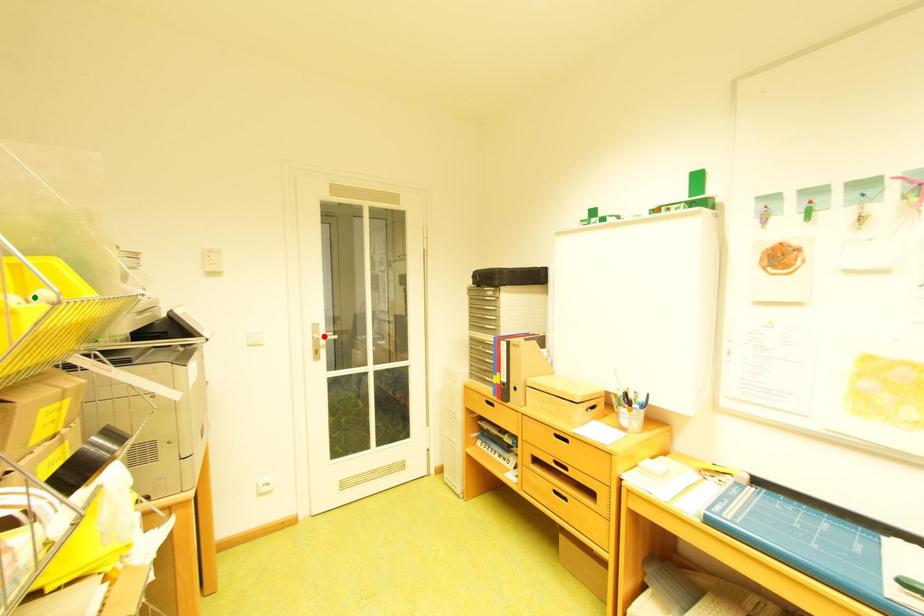
In the scene shown: Order these from nearest to farthest:
A) green point
B) orange point
C) red point

1. green point
2. orange point
3. red point